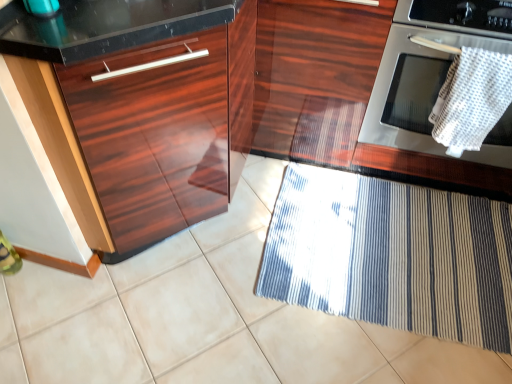
You are a GUI agent. You are given a task and a screenshot of the screen. Output one action in this format:
    pyautogui.click(x=<x>, y=<y>)
    Task: Click on the free spot in front of brushed metal kettle at upper left
    The image size is (512, 384).
    Given the screenshot: What is the action you would take?
    pyautogui.click(x=38, y=34)